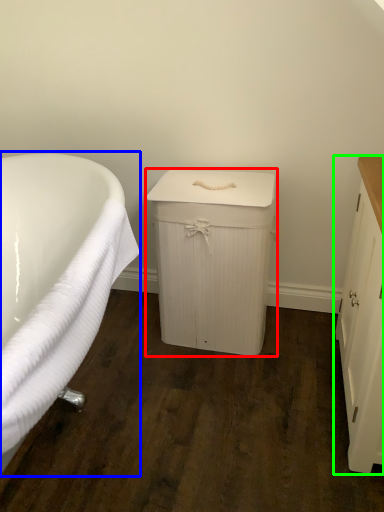
Question: Which is farther away from cabinetry (highlighted by a red box)? bathtub (highlighted by a blue box) or cabinetry (highlighted by a green box)?

Choices:
 (A) bathtub
 (B) cabinetry

Answer: (B)